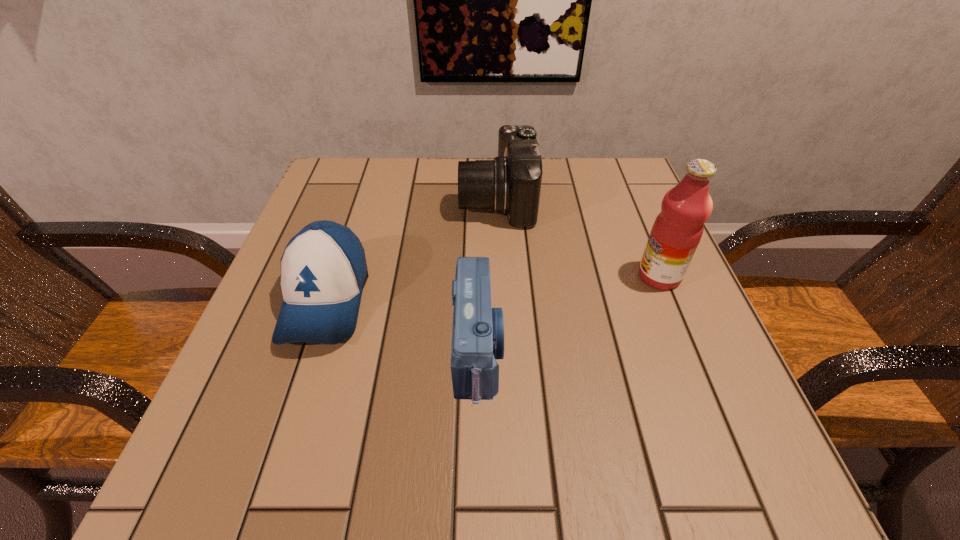
Image resolution: width=960 pixels, height=540 pixels. In the image, there is a desktop. What are the coordinates of `vacant space at the right edge` in the screenshot? It's located at (751, 428).

Where is `vacant space at the far left corner of the desktop`? The image size is (960, 540). vacant space at the far left corner of the desktop is located at coordinates (345, 199).

At what (x,y) coordinates should I click in order to perform the action: click on blank area at the far right corner. Please return your answer as a coordinate pair (x, y). Image resolution: width=960 pixels, height=540 pixels. Looking at the image, I should click on (590, 203).

Identify the location of free space between the rightmost object and the leftmost object. (492, 288).

The image size is (960, 540). Find the location of `free area in between the leftmost object and the nearer camera`. free area in between the leftmost object and the nearer camera is located at coordinates (402, 325).

Image resolution: width=960 pixels, height=540 pixels. In order to click on vacant area that lies between the farthest object and the tallest object in this screenshot , I will do `click(578, 238)`.

In order to click on unoccupied position between the baseball cap and the fruit juice in this screenshot , I will do `click(492, 288)`.

This screenshot has width=960, height=540. I want to click on vacant space that's between the nearer camera and the rightmost object, so click(x=568, y=313).

Find the location of `vacant region between the fruit juice and the farthest object`. vacant region between the fruit juice and the farthest object is located at coordinates (578, 238).

Where is `free space between the tallest object and the taller camera`? free space between the tallest object and the taller camera is located at coordinates (578, 238).